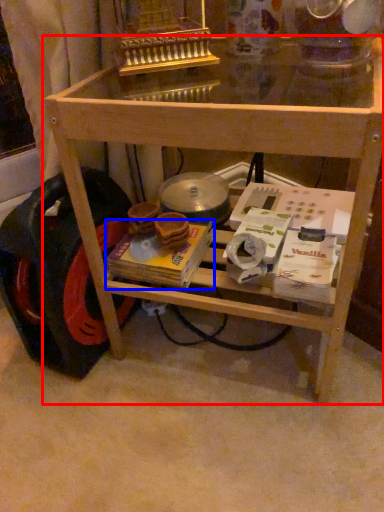
Question: Which object appears farthest to the camera in this image, table (highlighted by a red box) or magazine (highlighted by a blue box)?

Choices:
 (A) table
 (B) magazine

Answer: (B)